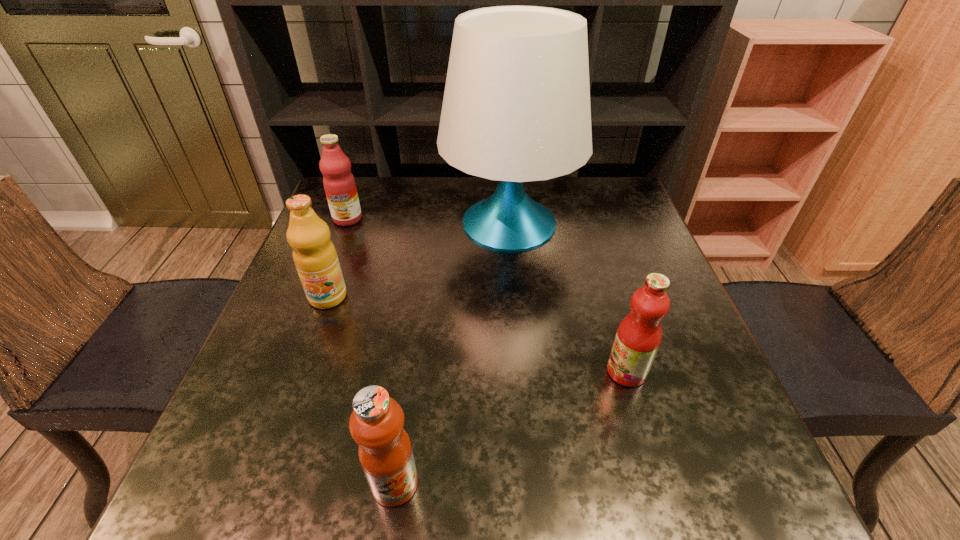
Find the location of `object identified as the closest to the second fruit juice from right to left`. object identified as the closest to the second fruit juice from right to left is located at coordinates (315, 257).

Image resolution: width=960 pixels, height=540 pixels. In order to click on object that is the third closest one to the farthest fruit juice in this screenshot , I will do `click(376, 423)`.

Select which fruit juice is the second closest to the farthest fruit juice. Please provide its 2D coordinates. Your answer should be formatted as a tuple, i.e. [(x, y)], where the tuple contains the x and y coordinates of a point satisfying the conditions above.

[(376, 423)]

The height and width of the screenshot is (540, 960). I want to click on fruit juice that is the second closest one to the third nearest fruit juice, so click(x=376, y=423).

Where is `free space in the image that satisfies the following two spatial constraints: 1. on the front label of the second nearest fruit juice; 2. on the front label of the nearest fruit juice`? The width and height of the screenshot is (960, 540). free space in the image that satisfies the following two spatial constraints: 1. on the front label of the second nearest fruit juice; 2. on the front label of the nearest fruit juice is located at coordinates (660, 483).

In order to click on vacant position in the image that satisfies the following two spatial constraints: 1. on the front label of the rightmost fruit juice; 2. on the front label of the nearest fruit juice in this screenshot , I will do `click(660, 483)`.